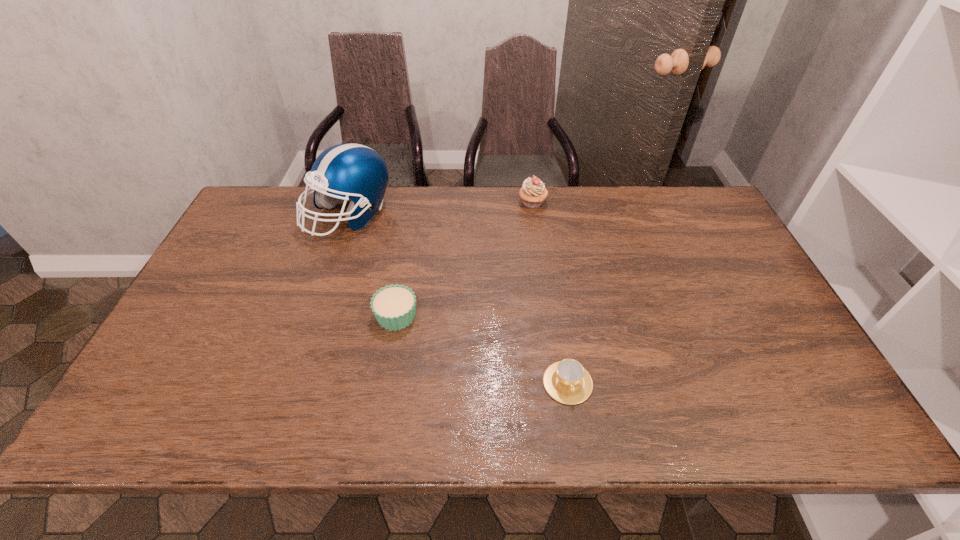
In order to click on vacant space located on the back of the nearer cupcake in this screenshot , I will do `click(410, 234)`.

Locate an element on the screen. The height and width of the screenshot is (540, 960). vacant space located 0.050m with the handle on the side of the shortest object is located at coordinates (574, 427).

The width and height of the screenshot is (960, 540). I want to click on football helmet that is at the far edge, so click(x=345, y=171).

This screenshot has height=540, width=960. I want to click on cupcake that is at the far edge, so click(x=533, y=192).

Find the location of a particular element. The height and width of the screenshot is (540, 960). object situated at the near edge is located at coordinates (567, 381).

Where is `vacant area at the far edge of the desktop`? vacant area at the far edge of the desktop is located at coordinates (404, 208).

Locate an element on the screen. vacant space at the near edge of the desktop is located at coordinates (432, 415).

Locate an element on the screen. This screenshot has height=540, width=960. free space at the left edge of the desktop is located at coordinates [x=227, y=276].

Where is `vacant area at the right edge`? Image resolution: width=960 pixels, height=540 pixels. vacant area at the right edge is located at coordinates point(773,315).

What are the coordinates of `vacant point located between the leftmost object and the third object from right to left` in the screenshot? It's located at (372, 265).